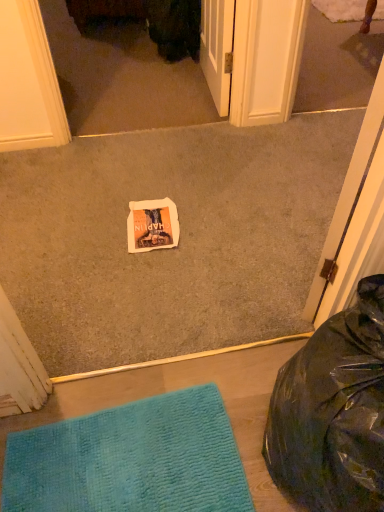
Question: From the image's perspective, is white paper at center above or below black plastic bean bag chair at lower right?

Choices:
 (A) above
 (B) below

Answer: (A)

Question: In terms of height, does white paper at center look taller or shorter compared to black plastic bean bag chair at lower right?

Choices:
 (A) short
 (B) tall

Answer: (A)

Question: Which of these objects is positioned farthest from the matte white screen door at upper center?

Choices:
 (A) black plastic bean bag chair at lower right
 (B) white paper at center
 (C) white paper at center
 (D) teal textured mat at lower left

Answer: (A)

Question: Which object is positioned farthest from the matte white screen door at upper center?

Choices:
 (A) teal textured mat at lower left
 (B) white paper at center
 (C) white paper at center
 (D) black plastic bean bag chair at lower right

Answer: (D)